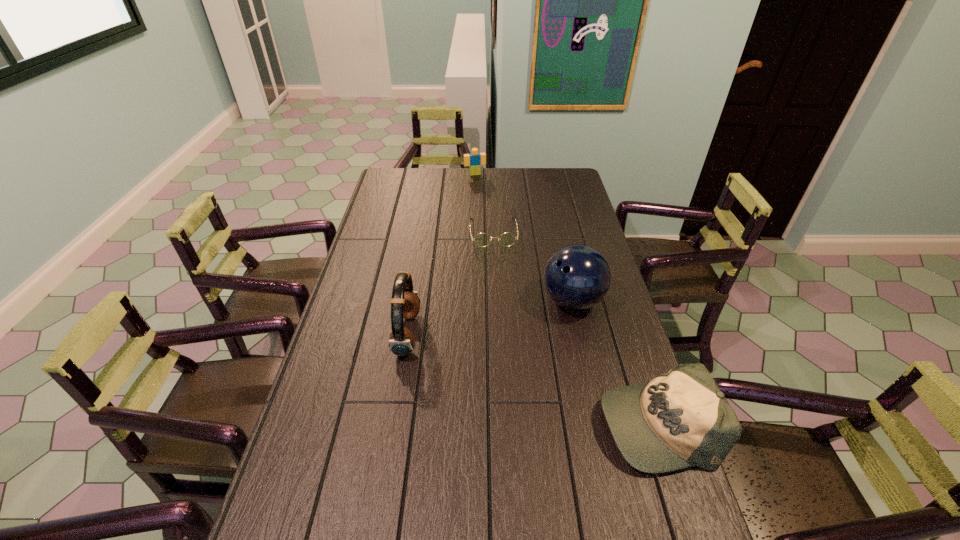
In order to click on vacant region located on the surface of the bowling ball near the finger holes in this screenshot , I will do `click(512, 362)`.

You are a GUI agent. You are given a task and a screenshot of the screen. Output one action in this format:
    pyautogui.click(x=<x>, y=<y>)
    Task: Click on the vacant space located on the surface of the bowling ball near the finger holes
    This screenshot has height=540, width=960.
    Given the screenshot: What is the action you would take?
    pyautogui.click(x=507, y=367)

The height and width of the screenshot is (540, 960). Identify the location of free region located on the surface of the bowling ball near the finger holes. click(535, 339).

The image size is (960, 540). I want to click on vacant region located 0.080m on the lenses of the shortest object, so click(x=496, y=261).

This screenshot has width=960, height=540. Find the location of `vacant space located 0.320m on the lenses of the shortest object`. vacant space located 0.320m on the lenses of the shortest object is located at coordinates (501, 306).

This screenshot has width=960, height=540. Find the location of `vacant region located on the lenses of the shortest object`. vacant region located on the lenses of the shortest object is located at coordinates (496, 266).

You are a GUI agent. You are given a task and a screenshot of the screen. Output one action in this format:
    pyautogui.click(x=<x>, y=<y>)
    Task: Click on the free space located 0.290m on the face of the farthest object
    
    Given the screenshot: What is the action you would take?
    pyautogui.click(x=490, y=208)

Where is `free space located 0.240m on the face of the farthest object`? free space located 0.240m on the face of the farthest object is located at coordinates (487, 202).

Locate an element on the screen. The image size is (960, 540). free region located on the face of the farthest object is located at coordinates (488, 204).

This screenshot has width=960, height=540. Find the location of `object that is at the far edge`. object that is at the far edge is located at coordinates (475, 160).